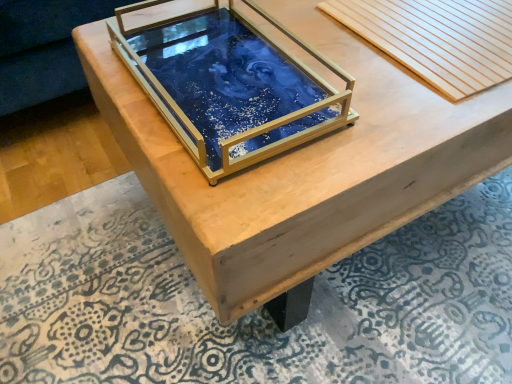
What do you see at coordinates (230, 85) in the screenshot? This screenshot has width=512, height=384. I see `blue resin tray at center` at bounding box center [230, 85].

At what (x,y) coordinates should I click in order to perform the action: click on blue resin tray at center. Please return your answer as a coordinate pair (x, y). The width and height of the screenshot is (512, 384). Looking at the image, I should click on (230, 85).

What is the approximate height of blue resin tray at center?

It is 1.72 inches.

You are a GUI agent. You are given a task and a screenshot of the screen. Output one action in this format:
    pyautogui.click(x=<x>, y=<y>)
    Task: Click on the blue resin tray at center
    This screenshot has height=384, width=512.
    Given the screenshot: What is the action you would take?
    pyautogui.click(x=230, y=85)

Is wooden slats at upper right bigger or smaller than blue resin tray at center?

Clearly, wooden slats at upper right is larger in size than blue resin tray at center.

Considering the positions of objects wooden slats at upper right and blue resin tray at center in the image provided, who is more to the right, wooden slats at upper right or blue resin tray at center?

From the viewer's perspective, wooden slats at upper right appears more on the right side.

Is wooden slats at upper right wider than blue resin tray at center?

In fact, wooden slats at upper right might be narrower than blue resin tray at center.

Which object is further away from the camera taking this photo, wooden slats at upper right or blue resin tray at center?

wooden slats at upper right.

Would you say wooden table at center is a long distance from blue resin tray at center?

Actually, wooden table at center and blue resin tray at center are a little close together.

How different are the orientations of wooden table at center and blue resin tray at center in degrees?

0.000921 degrees separate the facing orientations of wooden table at center and blue resin tray at center.

Between wooden table at center and blue resin tray at center, which one is positioned in front?

wooden table at center is closer to the camera.

Measure the distance from wooden table at center to blue resin tray at center.

wooden table at center is 3.82 inches away from blue resin tray at center.

Is blue resin tray at center spatially inside wooden slats at upper right, or outside of it?

blue resin tray at center is spatially situated outside wooden slats at upper right.

Measure the distance between blue resin tray at center and wooden slats at upper right.

A distance of 22.22 inches exists between blue resin tray at center and wooden slats at upper right.

Is blue resin tray at center at the left side of wooden slats at upper right?

Correct, you'll find blue resin tray at center to the left of wooden slats at upper right.

Between blue resin tray at center and wooden slats at upper right, which one has more height?

wooden slats at upper right.

Which object is further away from the camera, wooden slats at upper right or blue resin tray at center?

wooden slats at upper right.

Consider the image. Can you confirm if wooden slats at upper right is shorter than blue resin tray at center?

Incorrect, the height of wooden slats at upper right does not fall short of that of blue resin tray at center.

Find the location of `mat on the left of wooden slats at upper right`. mat on the left of wooden slats at upper right is located at coordinates (254, 310).

Is wooden slats at upper right located outside blue resin tray at center?

Yes, wooden slats at upper right is not within blue resin tray at center.

From a real-world perspective, relative to wooden table at center, is wooden slats at upper right vertically above or below?

In terms of real-world spatial position, wooden slats at upper right is above wooden table at center.

How many degrees apart are the facing directions of wooden slats at upper right and wooden table at center?

The facing directions of wooden slats at upper right and wooden table at center are 0.00155 degrees apart.

Consider the image. From the image's perspective, is wooden slats at upper right located beneath wooden table at center?

No, from the image's perspective, wooden slats at upper right is not beneath wooden table at center.

Considering the positions of objects wooden slats at upper right and wooden table at center in the image provided, who is more to the left, wooden slats at upper right or wooden table at center?

A: wooden table at center.

From their relative heights in the image, would you say blue resin tray at center is taller or shorter than blue resin tray at center?

blue resin tray at center is taller than blue resin tray at center.

Which point is more distant from viewer, (218, 69) or (416, 283)?

Point (416, 283)

From a real-world perspective, is blue resin tray at center physically located above or below blue resin tray at center?

From a real-world perspective, blue resin tray at center is physically above blue resin tray at center.

Is blue resin tray at center taller than wooden slats at upper right?

Yes.

Considering the sizes of objects blue resin tray at center and wooden slats at upper right in the image provided, who is smaller, blue resin tray at center or wooden slats at upper right?

blue resin tray at center is smaller.

How many degrees apart are the facing directions of blue resin tray at center and wooden slats at upper right?

They differ by 0.000631 degrees in their facing directions.

Does blue resin tray at center appear on the left side of wooden slats at upper right?

Yes.

This screenshot has width=512, height=384. What are the coordinates of `plank above the blue resin tray at center (from the image's perspective)` in the screenshot? It's located at (437, 38).

Locate an element on the screen. The height and width of the screenshot is (384, 512). glass box above the wooden table at center (from a real-world perspective) is located at coordinates (230, 85).

Estimate the real-world distances between objects in this image. Which object is further from wooden slats at upper right, blue resin tray at center or blue resin tray at center?

Based on the image, blue resin tray at center appears to be further to wooden slats at upper right.

In the scene shown: Estimate the real-world distances between objects in this image. Which object is closer to wooden table at center, blue resin tray at center or wooden slats at upper right?

Among the two, blue resin tray at center is located nearer to wooden table at center.

When comparing their distances from blue resin tray at center, does wooden slats at upper right or blue resin tray at center seem further?

wooden slats at upper right is further to blue resin tray at center.

Consider the image. Considering their positions, is wooden slats at upper right positioned closer to wooden table at center than blue resin tray at center?

Among the two, blue resin tray at center is located nearer to wooden table at center.

From the picture: Which object lies further to the anchor point wooden slats at upper right, wooden table at center or blue resin tray at center?

blue resin tray at center is further to wooden slats at upper right.

Estimate the real-world distances between objects in this image. Which object is closer to blue resin tray at center, blue resin tray at center or wooden table at center?

wooden table at center is closer to blue resin tray at center.

From the image, which object appears to be farther from wooden table at center, blue resin tray at center or blue resin tray at center?

The object further to wooden table at center is blue resin tray at center.

Based on the photo, from the image, which object appears to be nearer to blue resin tray at center, wooden slats at upper right or wooden table at center?

wooden table at center is positioned closer to the anchor blue resin tray at center.

Locate an element on the screen. The image size is (512, 384). glass box between wooden table at center and blue resin tray at center from top to bottom is located at coordinates (230, 85).

Find the location of a particular element. This screenshot has height=384, width=512. glass box between wooden slats at upper right and blue resin tray at center in the vertical direction is located at coordinates pos(230,85).

I want to click on table between blue resin tray at center and wooden slats at upper right, so click(304, 168).

Locate an element on the screen. The height and width of the screenshot is (384, 512). table between wooden slats at upper right and blue resin tray at center vertically is located at coordinates (304, 168).